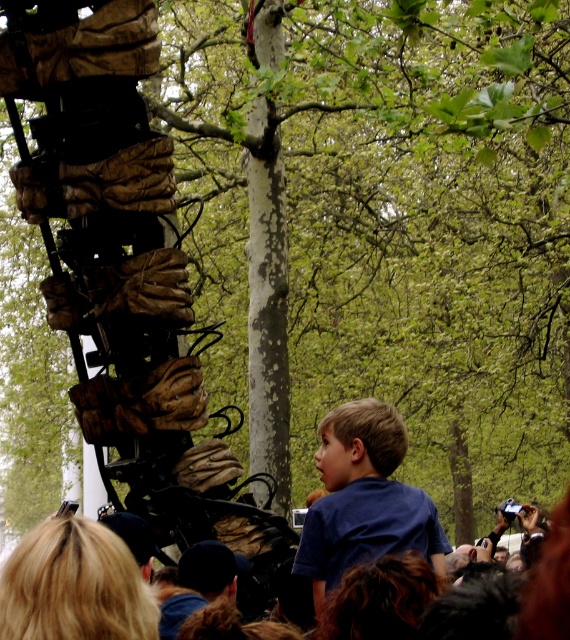
Question: Among these points, which one is farthest from the camera?

Choices:
 (A) (189, 614)
 (B) (431, 554)

Answer: (B)

Question: Is blue cotton shirt at center below dark blue fabric cap at center?

Choices:
 (A) no
 (B) yes

Answer: (A)

Question: Can you confirm if blue cotton shirt at center is positioned below dark blue fabric cap at center?

Choices:
 (A) yes
 (B) no

Answer: (B)

Question: Can you confirm if blue cotton shirt at center is thinner than dark blue fabric cap at center?

Choices:
 (A) no
 (B) yes

Answer: (A)